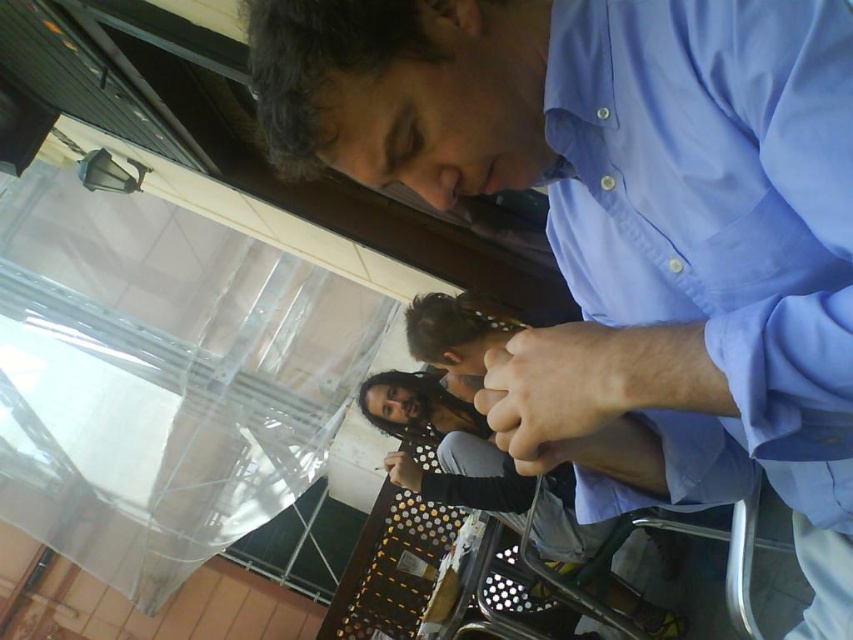
Question: Which point is closer to the camera?

Choices:
 (A) (463, 42)
 (B) (486, 355)
 (C) (837, 67)
 (D) (421, 483)

Answer: (C)

Question: Among these points, which one is farthest from the camera?

Choices:
 (A) (408, 484)
 (B) (611, 358)
 (C) (677, 461)

Answer: (A)

Question: Is smooth skin hand at center wider than matte black pen at lower center?

Choices:
 (A) no
 (B) yes

Answer: (B)

Question: Which object is the closest to the smooth skin hand at center?

Choices:
 (A) blue cotton shirt at upper right
 (B) matte black pen at lower center

Answer: (A)

Question: Is smooth skin hand at center further to camera compared to matte black pen at lower center?

Choices:
 (A) yes
 (B) no

Answer: (B)

Question: Does blue cotton shirt at upper right appear on the right side of smooth skin hand at center?

Choices:
 (A) no
 (B) yes

Answer: (B)